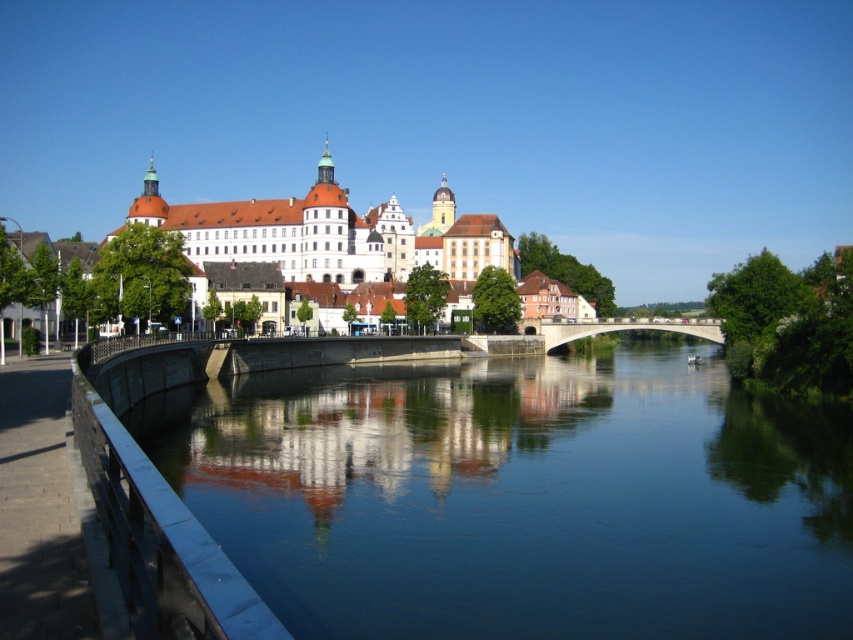
You are planning to cross the river using a small boat that can carry up to two people. Based on the scene, can you determine if the smooth concrete river at center is wide enough to allow your boat to pass safely between the banks without hitting the white stone castle at center?

The smooth concrete river at center might be wider than white stone castle at center, so it is possible that the river is wide enough for the boat to pass safely between the banks without hitting the castle. However, the exact width is uncertain based on the provided information.

You are a tourist standing on the riverside path and want to take a photo of the smooth concrete river at center and the concrete bridge at center. Which object should you focus on first if you want to capture both in a single frame without moving your camera?

You should focus on the smooth concrete river at center first because it is positioned on the left side of the concrete bridge at center, so by centering your camera on the river, you can include both objects in the frame without needing to adjust your position.

You are standing at the point marked by the coordinate point at point (520,497). Looking around, you see the grand historic building with multiple towers and domes. Which direction should you walk to reach the smooth concrete river at center?

The point at point (520,497) is the location of the smooth concrete river at center, so you are already at the river.